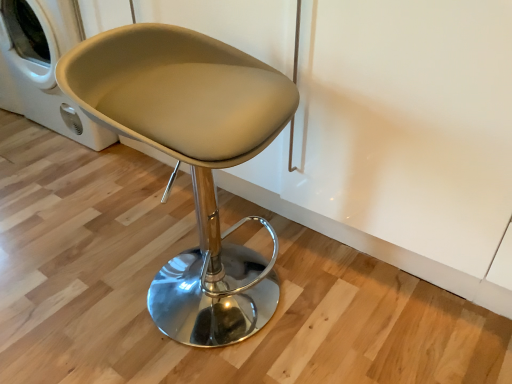
Locate an element on the screen. Image resolution: width=512 pixels, height=384 pixels. white glossy washing machine at left is located at coordinates (47, 65).

What do you see at coordinates (47, 65) in the screenshot? The image size is (512, 384). I see `white glossy washing machine at left` at bounding box center [47, 65].

This screenshot has height=384, width=512. Identify the location of beige leather stool at center. (191, 158).

Image resolution: width=512 pixels, height=384 pixels. Describe the element at coordinates (191, 158) in the screenshot. I see `beige leather stool at center` at that location.

Where is `white glossy washing machine at left`? This screenshot has height=384, width=512. white glossy washing machine at left is located at coordinates (47, 65).

Visually, is white glossy washing machine at left positioned to the left or to the right of beige leather stool at center?

Clearly, white glossy washing machine at left is on the left of beige leather stool at center in the image.

Who is more distant, white glossy washing machine at left or beige leather stool at center?

white glossy washing machine at left is behind.

Based on the photo, which is more distant, [51,127] or [174,91]?

The point [51,127] is farther.

From the image's perspective, between white glossy washing machine at left and beige leather stool at center, who is located below?

beige leather stool at center appears lower in the image.

From a real-world perspective, which is physically below, white glossy washing machine at left or beige leather stool at center?

white glossy washing machine at left.

Is white glossy washing machine at left wider than beige leather stool at center?

Yes.

Considering the relative sizes of white glossy washing machine at left and beige leather stool at center in the image provided, is white glossy washing machine at left shorter than beige leather stool at center?

Indeed, white glossy washing machine at left has a lesser height compared to beige leather stool at center.

Which of these two, white glossy washing machine at left or beige leather stool at center, is smaller?

beige leather stool at center is smaller.

Is beige leather stool at center completely or partially inside white glossy washing machine at left?

Definitely not — beige leather stool at center is not inside white glossy washing machine at left.

Consider the image. Is white glossy washing machine at left in contact with beige leather stool at center?

white glossy washing machine at left is not next to beige leather stool at center, and they're not touching.

Is white glossy washing machine at left positioned with its back to beige leather stool at center?

No, white glossy washing machine at left is not facing away from beige leather stool at center.

How distant is white glossy washing machine at left from beige leather stool at center?

white glossy washing machine at left is 98.54 centimeters away from beige leather stool at center.

Locate an element on the screen. The image size is (512, 384). washing machine behind the beige leather stool at center is located at coordinates (47, 65).

Is beige leather stool at center to the left or to the right of white glossy washing machine at left in the image?

Based on their positions, beige leather stool at center is located to the right of white glossy washing machine at left.

Relative to white glossy washing machine at left, is beige leather stool at center in front or behind?

beige leather stool at center is in front of white glossy washing machine at left.

Is point (133, 86) closer or farther from the camera than point (49, 14)?

Point (133, 86).

From the image's perspective, would you say beige leather stool at center is shown under white glossy washing machine at left?

Indeed, from the image's perspective, beige leather stool at center is shown beneath white glossy washing machine at left.

From a real-world perspective, is beige leather stool at center above or below white glossy washing machine at left?

In terms of real-world spatial position, beige leather stool at center is above white glossy washing machine at left.

Does beige leather stool at center have a greater width compared to white glossy washing machine at left?

In fact, beige leather stool at center might be narrower than white glossy washing machine at left.

Can you confirm if beige leather stool at center is shorter than white glossy washing machine at left?

Incorrect, the height of beige leather stool at center does not fall short of that of white glossy washing machine at left.

Considering the sizes of objects beige leather stool at center and white glossy washing machine at left in the image provided, who is bigger, beige leather stool at center or white glossy washing machine at left?

Bigger between the two is white glossy washing machine at left.

Is beige leather stool at center outside of white glossy washing machine at left?

Yes, beige leather stool at center is located beyond the bounds of white glossy washing machine at left.

Is beige leather stool at center next to white glossy washing machine at left and touching it?

beige leather stool at center is not next to white glossy washing machine at left, and they're not touching.

Is beige leather stool at center oriented away from white glossy washing machine at left?

No.

From the picture: How different are the orientations of beige leather stool at center and white glossy washing machine at left in degrees?

There is a 98.7-degree angle between the facing directions of beige leather stool at center and white glossy washing machine at left.

Where is `chair located below the white glossy washing machine at left (from the image's perspective)`? The width and height of the screenshot is (512, 384). chair located below the white glossy washing machine at left (from the image's perspective) is located at coordinates point(191,158).

Identify the location of chair lying in front of the white glossy washing machine at left. (191, 158).

What are the coordinates of `chair that is below the white glossy washing machine at left (from the image's perspective)` in the screenshot? It's located at (191, 158).